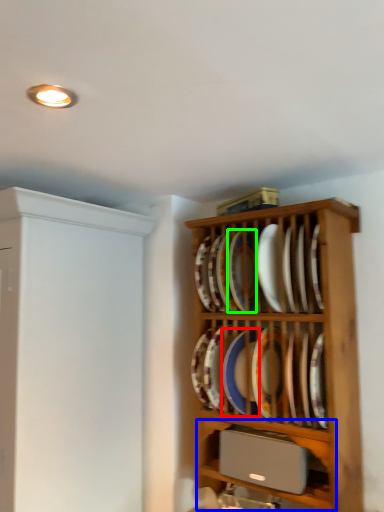
Question: Considering the real-world distances, which object is farthest from platter (highlighted by a red box)? shelf (highlighted by a blue box) or platter (highlighted by a green box)?

Choices:
 (A) shelf
 (B) platter

Answer: (A)